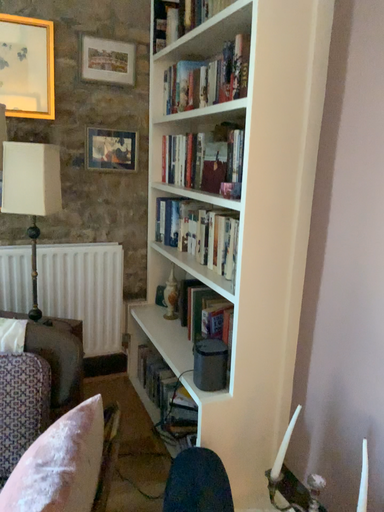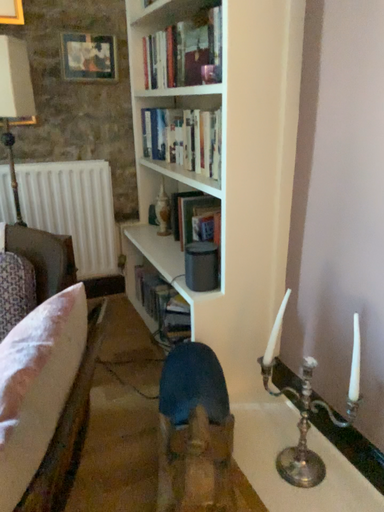
Question: Which way did the camera rotate in the video?

Choices:
 (A) rotated downward
 (B) rotated upward

Answer: (A)